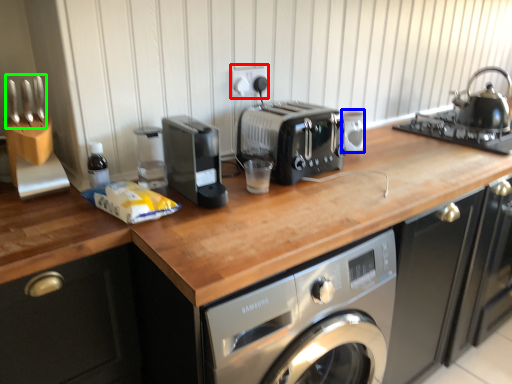
Question: Based on their relative distances, which object is nearer to electric outlet (highlighted by a red box)? Choose from appliance (highlighted by a blue box) and cutlery (highlighted by a green box).

Choices:
 (A) appliance
 (B) cutlery

Answer: (A)